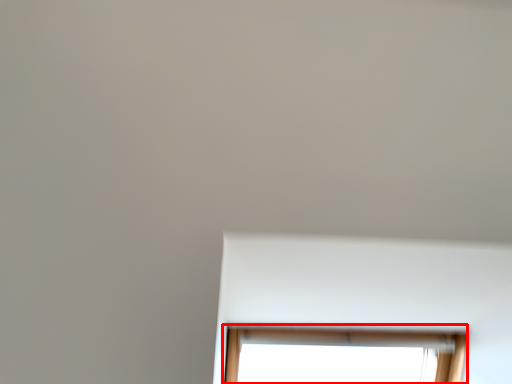
Question: From the image's perspective, considering the relative positions of window (annotated by the red box) and bay window in the image provided, where is window (annotated by the red box) located with respect to the staircase?

Choices:
 (A) above
 (B) below

Answer: (B)